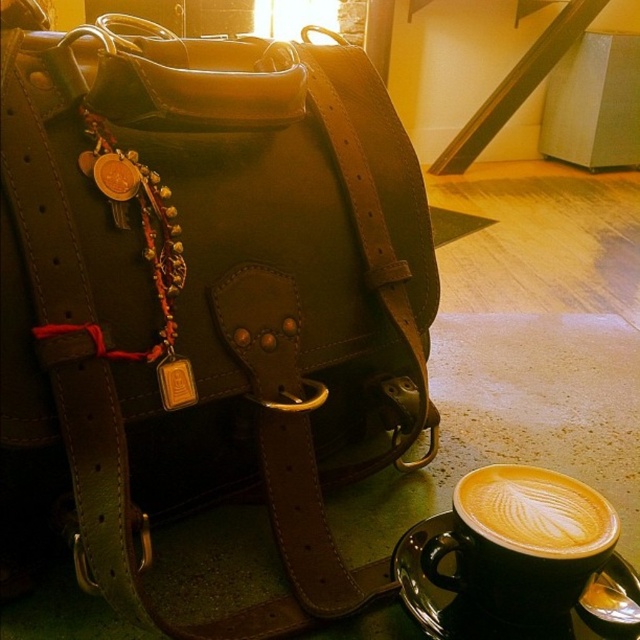
In the scene shown: Who is positioned more to the right, brown leather bag at center or golden frothy latte at lower right?

From the viewer's perspective, golden frothy latte at lower right appears more on the right side.

In the scene shown: Which is more to the left, brown leather bag at center or golden frothy latte at lower right?

brown leather bag at center

You are a GUI agent. You are given a task and a screenshot of the screen. Output one action in this format:
    pyautogui.click(x=<x>, y=<y>)
    Task: Click on the brown leather bag at center
    
    Given the screenshot: What is the action you would take?
    pyautogui.click(x=204, y=296)

The height and width of the screenshot is (640, 640). Find the location of `brown leather bag at center`. brown leather bag at center is located at coordinates (204, 296).

Is brown leather bag at center bigger than cappuccino foam at lower right?

Yes.

The height and width of the screenshot is (640, 640). What are the coordinates of `brown leather bag at center` in the screenshot? It's located at (204, 296).

Is golden frothy latte at lower right thinner than cappuccino foam at lower right?

No.

Is point (516, 500) positioned in front of point (508, 538)?

No.

Between point (480, 534) and point (547, 522), which one is positioned behind?

Point (547, 522)

Where is `golden frothy latte at lower right`? The width and height of the screenshot is (640, 640). golden frothy latte at lower right is located at coordinates (522, 541).